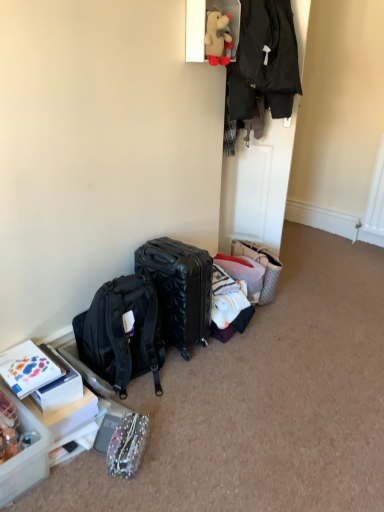
Question: In terms of height, does white cotton shirt at center, arranged as the 2th clothing when viewed from the top, look taller or shorter compared to sparkly fabric pouch at lower left?

Choices:
 (A) short
 (B) tall

Answer: (B)

Question: Choose the correct answer: Is white cotton shirt at center, placed as the 1th clothing when sorted from bottom to top, inside sparkly fabric pouch at lower left or outside it?

Choices:
 (A) inside
 (B) outside

Answer: (B)

Question: Estimate the real-world distances between objects in this image. Which object is farther from the sparkly fabric pouch at lower left?

Choices:
 (A) matte black backpack at center
 (B) white plush teddy bear at upper center
 (C) translucent plastic container at lower left
 (D) white cotton shirt at center, placed as the 1th clothing when sorted from bottom to top
 (E) black textured suitcase at center

Answer: (B)

Question: Estimate the real-world distances between objects in this image. Which object is closer to the sparkly fabric pouch at lower left?

Choices:
 (A) translucent plastic container at lower left
 (B) black matte jacket at upper right, the second clothing from the bottom
 (C) black textured suitcase at center
 (D) black hardshell suitcase at center
 (E) matte black backpack at center

Answer: (A)